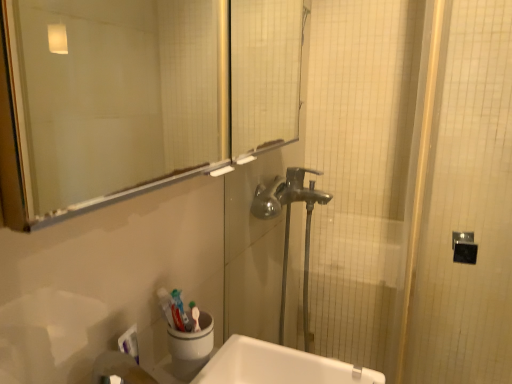
Question: Is white glossy sink at lower center not inside transparent glass mirror at upper center?

Choices:
 (A) no
 (B) yes

Answer: (B)

Question: Is the depth of white glossy sink at lower center greater than that of transparent glass mirror at upper center?

Choices:
 (A) no
 (B) yes

Answer: (B)

Question: Considering the relative sizes of white glossy sink at lower center and transparent glass mirror at upper center in the image provided, is white glossy sink at lower center shorter than transparent glass mirror at upper center?

Choices:
 (A) yes
 (B) no

Answer: (A)

Question: Is white glossy sink at lower center to the right of transparent glass mirror at upper center from the viewer's perspective?

Choices:
 (A) yes
 (B) no

Answer: (A)

Question: Considering the relative sizes of white glossy sink at lower center and transparent glass mirror at upper center in the image provided, is white glossy sink at lower center wider than transparent glass mirror at upper center?

Choices:
 (A) yes
 (B) no

Answer: (A)

Question: From a real-world perspective, is white glossy sink at lower center physically above transparent glass mirror at upper center?

Choices:
 (A) yes
 (B) no

Answer: (B)

Question: From the image's perspective, is transparent glass mirror at upper center under polished chrome faucet at center?

Choices:
 (A) no
 (B) yes

Answer: (A)

Question: Considering the relative sizes of transparent glass mirror at upper center and polished chrome faucet at center in the image provided, is transparent glass mirror at upper center bigger than polished chrome faucet at center?

Choices:
 (A) yes
 (B) no

Answer: (B)

Question: Does transparent glass mirror at upper center appear on the left side of polished chrome faucet at center?

Choices:
 (A) no
 (B) yes

Answer: (B)

Question: Is transparent glass mirror at upper center shorter than polished chrome faucet at center?

Choices:
 (A) yes
 (B) no

Answer: (A)

Question: Is transparent glass mirror at upper center smaller than polished chrome faucet at center?

Choices:
 (A) yes
 (B) no

Answer: (A)

Question: From a real-world perspective, is transparent glass mirror at upper center located higher than polished chrome faucet at center?

Choices:
 (A) yes
 (B) no

Answer: (A)

Question: Is transparent glass mirror at upper center thinner than white glossy sink at lower center?

Choices:
 (A) yes
 (B) no

Answer: (A)